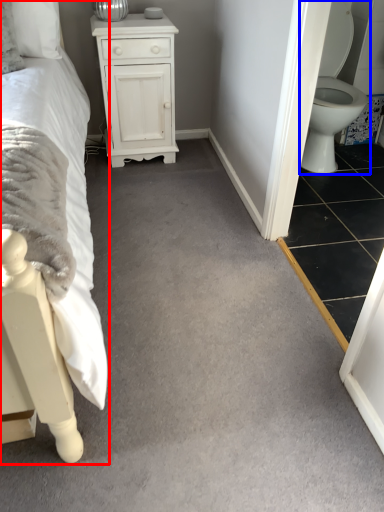
Question: Which point is further to the camera, bed (highlighted by a red box) or toilet (highlighted by a blue box)?

Choices:
 (A) bed
 (B) toilet

Answer: (B)